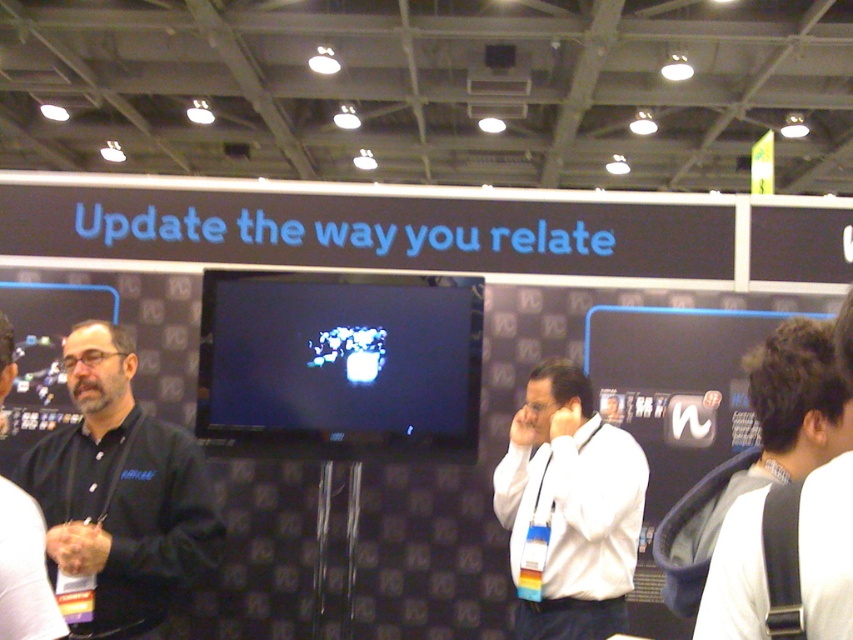
You are a photographer at the trade show. You want to take a photo of the black matte shirt at left. Your camera is 6.48 feet away from the subject. Is the distance within the camera manufacturer recommended minimum focus distance of 5 feet?

The black matte shirt at left and camera are 6.48 feet apart. Since the recommended minimum focus distance is 5 feet, the camera can focus on the subject as the distance is greater than the minimum requirement.

You are an event organizer at the trade show. You need to inform both the person wearing the black matte shirt at left and the white shirt at right about an urgent announcement. Which person is closer to you if you are standing at the entrance facing the crowd?

The black matte shirt at left is closer to you because the white shirt at right is behind them.

You are standing at the point marked as point (581, 426) in the trade show venue. If you want to take a photo of the large display banner with your phone camera, which is 8.35 feet away from you, will you be able to capture the entire banner in the photo without moving your position?

The camera is 8.35 feet away from point (581, 426). To capture the entire banner, ensure the camera angle and lens can encompass the banner size at that distance.